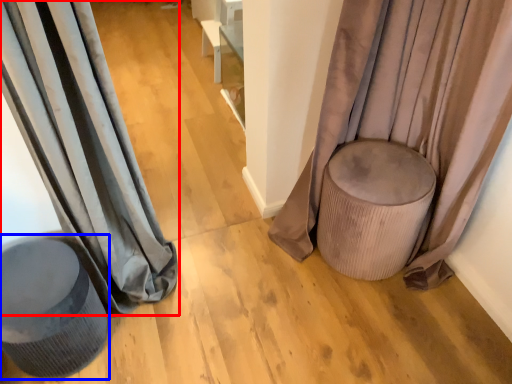
Question: Which object appears farthest to the camera in this image, curtain (highlighted by a red box) or swivel chair (highlighted by a blue box)?

Choices:
 (A) curtain
 (B) swivel chair

Answer: (B)